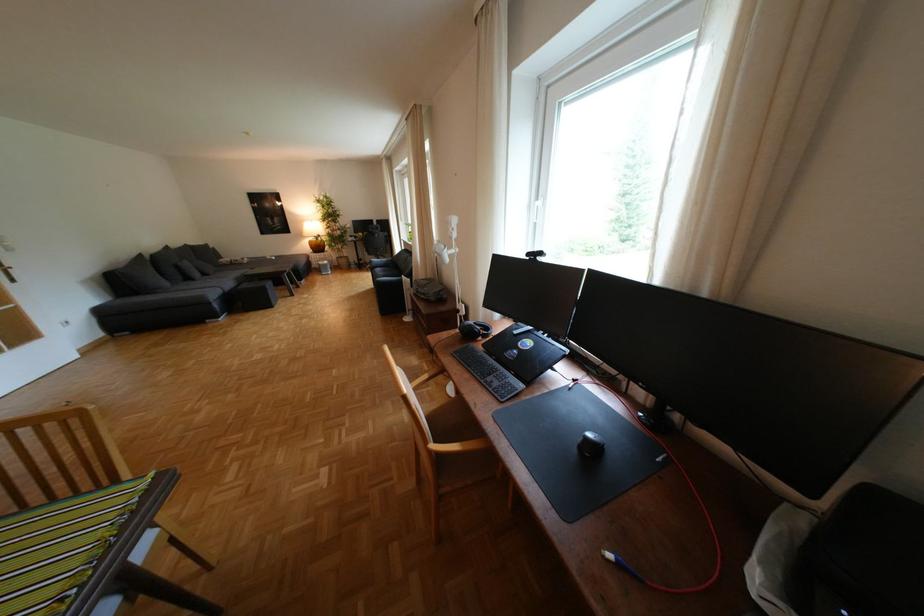
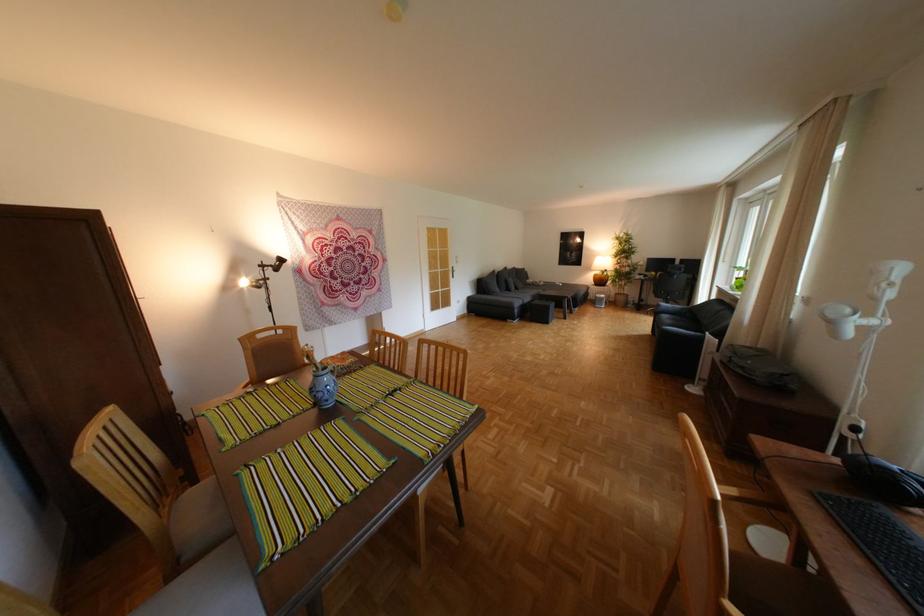
The point at (480, 376) is marked in the first image. Where is the corresponding point in the second image?

(870, 560)